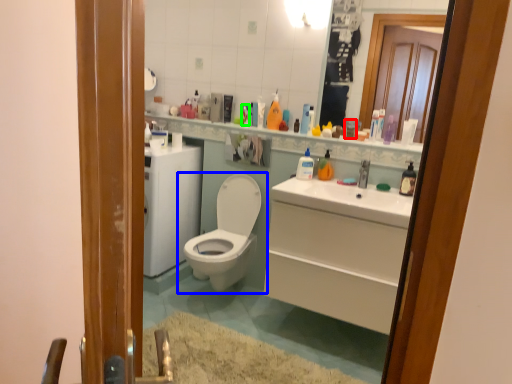
Question: Based on their relative distances, which object is farther from toiletry (highlighted by a red box)? Choose from toilet (highlighted by a blue box) and toiletry (highlighted by a green box).

Choices:
 (A) toilet
 (B) toiletry

Answer: (A)